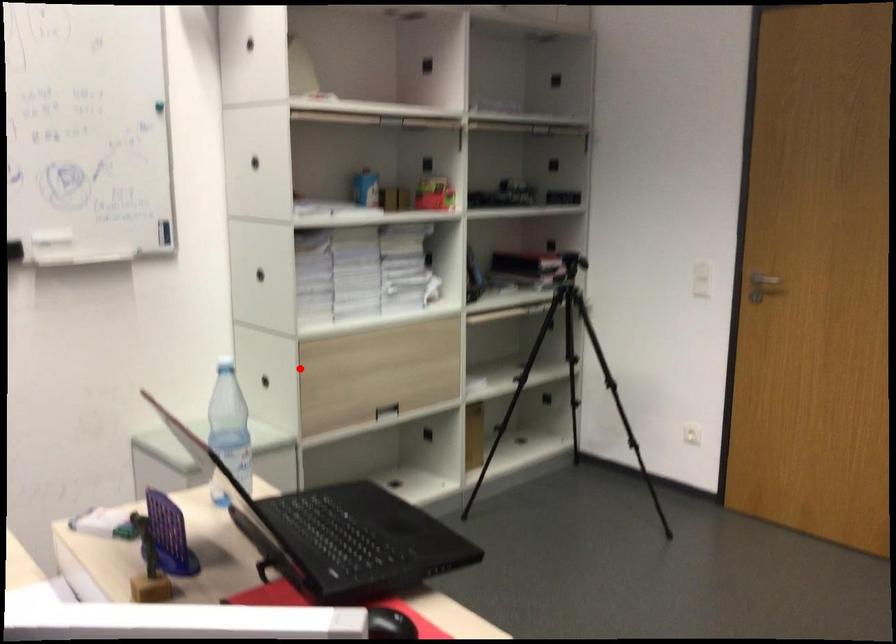
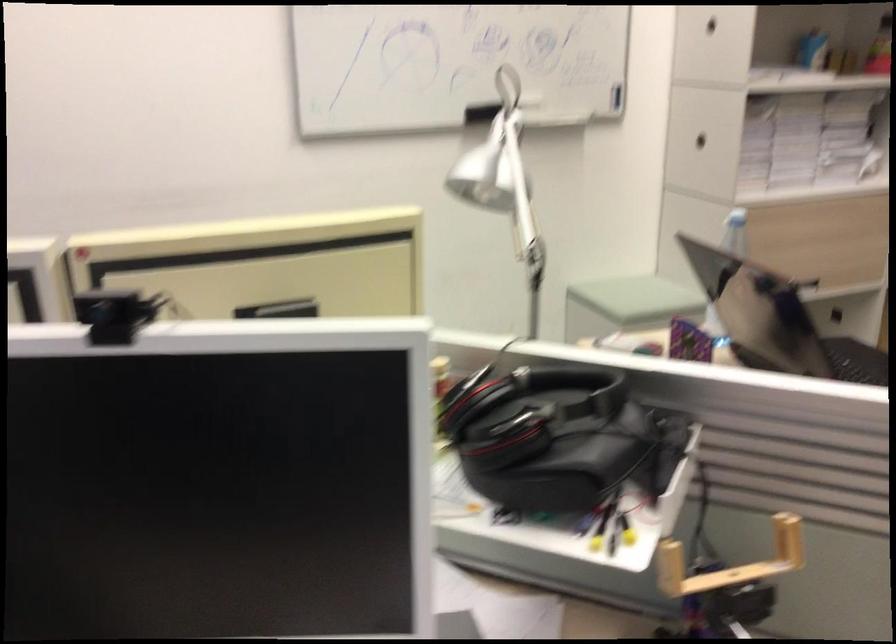
Find the pixel in the second image that matches the highlighted location in the first image.

(735, 232)